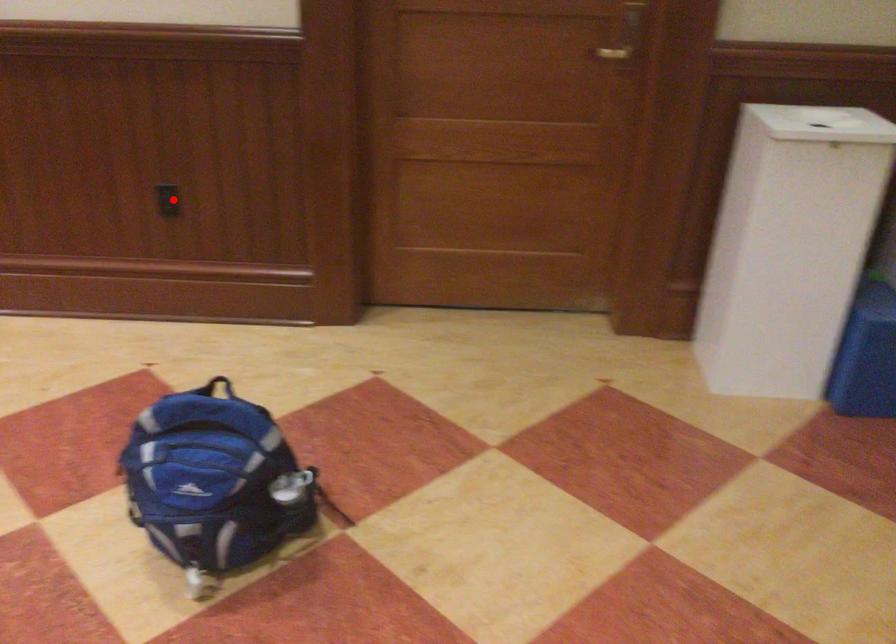
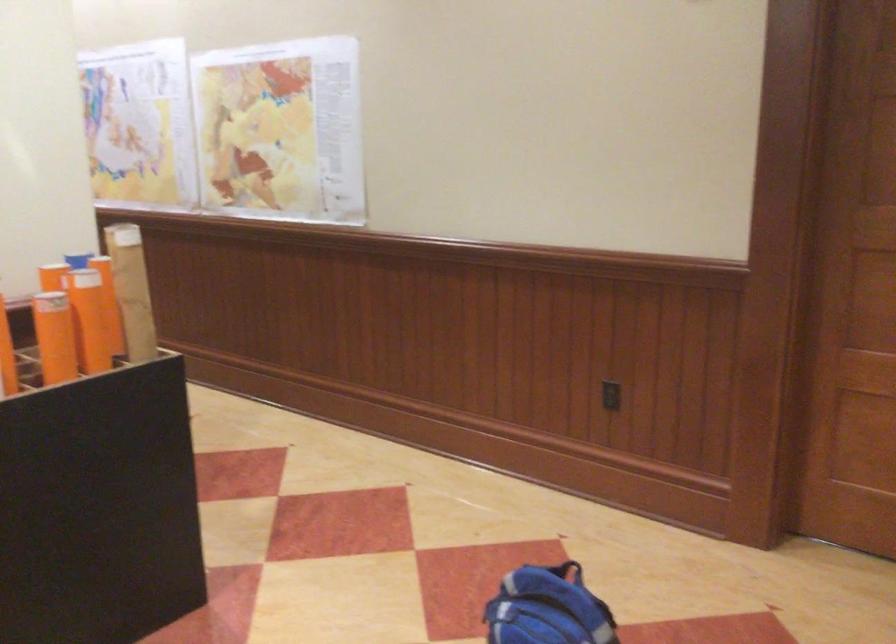
Question: I am providing you with two images of the same scene from different viewpoints. Image1 has a red point marked. In image2, the corresponding 3D location appears at what relative position? Reply with the corresponding letter.

Choices:
 (A) Closer
 (B) Farther

Answer: (B)